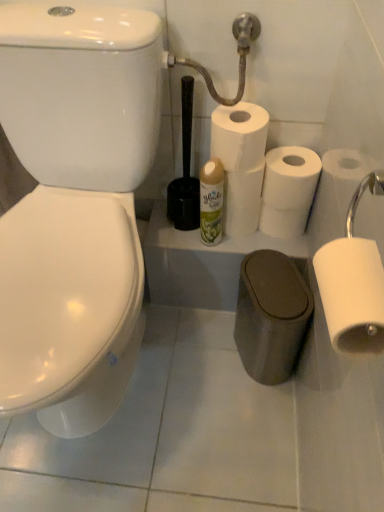
Question: Would you say white matte toilet paper at center, which is the 2th toilet paper from front to back, is part of black plastic toilet brush at center's contents?

Choices:
 (A) yes
 (B) no

Answer: (B)

Question: Can you confirm if black plastic toilet brush at center is positioned to the left of white matte toilet paper at center, the fourth toilet paper when ordered from back to front?

Choices:
 (A) yes
 (B) no

Answer: (A)

Question: Does black plastic toilet brush at center have a larger size compared to white matte toilet paper at center, the fourth toilet paper when ordered from back to front?

Choices:
 (A) no
 (B) yes

Answer: (B)

Question: Is the position of black plastic toilet brush at center more distant than that of white matte toilet paper at center, the fourth toilet paper when ordered from back to front?

Choices:
 (A) yes
 (B) no

Answer: (B)

Question: Is black plastic toilet brush at center not inside white matte toilet paper at center, which is the 2th toilet paper from front to back?

Choices:
 (A) yes
 (B) no

Answer: (A)

Question: From the image's perspective, is black plastic toilet brush at center located above white matte toilet paper at center, the fourth toilet paper when ordered from back to front?

Choices:
 (A) yes
 (B) no

Answer: (B)

Question: Considering the relative positions of white matte toilet paper at center, which appears as the fifth toilet paper when viewed from the front, and white matte toilet paper at right, acting as the first toilet paper starting from the front, in the image provided, is white matte toilet paper at center, which appears as the fifth toilet paper when viewed from the front, to the right of white matte toilet paper at right, acting as the first toilet paper starting from the front, from the viewer's perspective?

Choices:
 (A) yes
 (B) no

Answer: (B)

Question: Is white matte toilet paper at center, which appears as the 1th toilet paper when viewed from the back, shorter than white matte toilet paper at right, which ranks as the 5th toilet paper in back-to-front order?

Choices:
 (A) no
 (B) yes

Answer: (A)

Question: From the image's perspective, is white matte toilet paper at center, which appears as the fifth toilet paper when viewed from the front, located beneath white matte toilet paper at right, which ranks as the 5th toilet paper in back-to-front order?

Choices:
 (A) yes
 (B) no

Answer: (B)

Question: Could you tell me if white matte toilet paper at center, which appears as the fifth toilet paper when viewed from the front, is facing white matte toilet paper at right, which ranks as the 5th toilet paper in back-to-front order?

Choices:
 (A) no
 (B) yes

Answer: (A)

Question: From the image's perspective, is white matte toilet paper at center, which appears as the fifth toilet paper when viewed from the front, above white matte toilet paper at right, which ranks as the 5th toilet paper in back-to-front order?

Choices:
 (A) no
 (B) yes

Answer: (B)

Question: Considering the relative sizes of white matte toilet paper at center, which appears as the 1th toilet paper when viewed from the back, and white matte toilet paper at right, acting as the first toilet paper starting from the front, in the image provided, is white matte toilet paper at center, which appears as the 1th toilet paper when viewed from the back, bigger than white matte toilet paper at right, acting as the first toilet paper starting from the front,?

Choices:
 (A) no
 (B) yes

Answer: (B)

Question: Does white matte toilet paper at center, positioned as the 2th toilet paper in back-to-front order, have a lesser height compared to black plastic toilet brush at center?

Choices:
 (A) yes
 (B) no

Answer: (A)